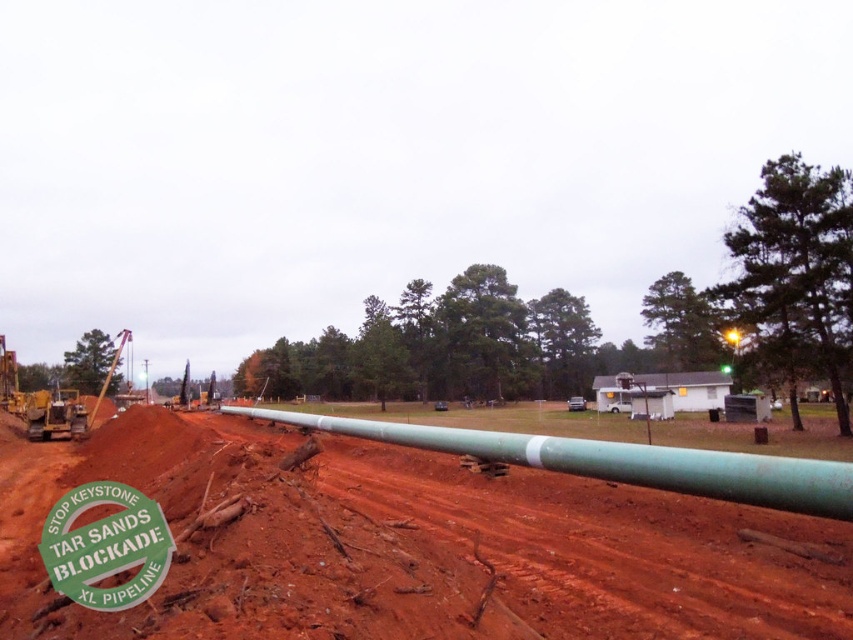
Question: Can you confirm if red clay dirt at center is bigger than green paper sign at lower left?

Choices:
 (A) no
 (B) yes

Answer: (B)

Question: Does red clay dirt at center come behind green paper sign at lower left?

Choices:
 (A) no
 (B) yes

Answer: (A)

Question: Among these objects, which one is farthest from the camera?

Choices:
 (A) red clay dirt at center
 (B) green paper sign at lower left
 (C) green matte pipe at center

Answer: (C)

Question: Is red clay dirt at center closer to camera compared to green matte pipe at center?

Choices:
 (A) no
 (B) yes

Answer: (B)

Question: Which point is farther to the camera?

Choices:
 (A) (326, 532)
 (B) (659, 461)
 (C) (134, 506)

Answer: (B)

Question: Which point is farther to the camera?

Choices:
 (A) red clay dirt at center
 (B) green paper sign at lower left
 (C) green matte pipe at center

Answer: (C)